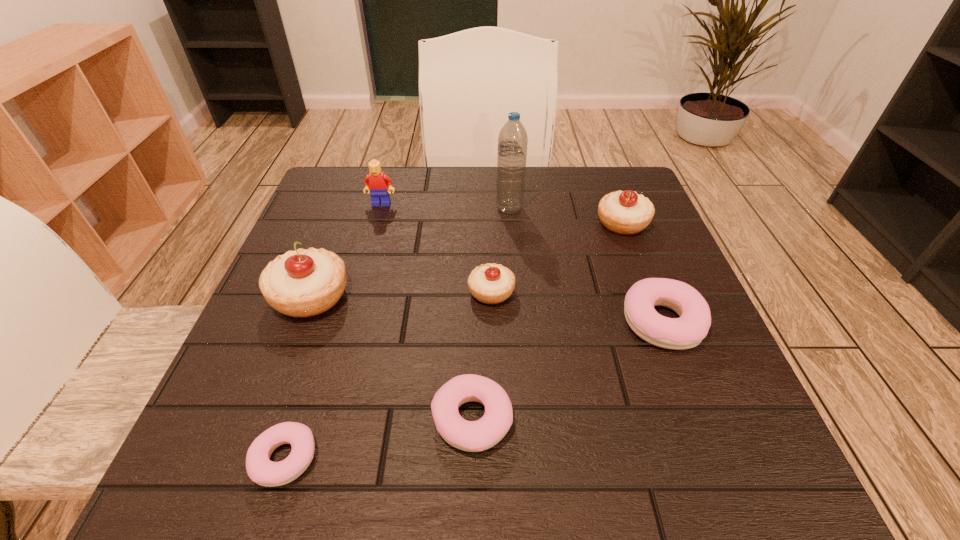
Find the location of `beige pastry that is the second closest to the tallest pastry`. beige pastry that is the second closest to the tallest pastry is located at coordinates (624, 212).

Find the location of a particular element. Image resolution: width=960 pixels, height=540 pixels. the second closest beige pastry to the tallest object is located at coordinates (491, 283).

Point out which pink pastry is positioned as the nearest to the second shortest object. Please provide its 2D coordinates. Your answer should be formatted as a tuple, i.e. [(x, y)], where the tuple contains the x and y coordinates of a point satisfying the conditions above.

[(260, 469)]

Where is `pink pastry that is the second nearest to the second shortest object`? pink pastry that is the second nearest to the second shortest object is located at coordinates (688, 331).

Locate an element on the screen. This screenshot has width=960, height=540. free spot that satisfies the following two spatial constraints: 1. on the back side of the tallest object; 2. on the right side of the second biggest pink pastry is located at coordinates (475, 208).

I want to click on vacant space that satisfies the following two spatial constraints: 1. on the face of the Lego; 2. on the right side of the biggest pink pastry, so click(x=348, y=322).

Find the location of a particular element. free space that satisfies the following two spatial constraints: 1. on the face of the second shortest object; 2. on the right side of the Lego is located at coordinates (322, 420).

Locate an element on the screen. vacant region that satisfies the following two spatial constraints: 1. on the front side of the tallest object; 2. on the left side of the biggest pink pastry is located at coordinates (518, 322).

You are a GUI agent. You are given a task and a screenshot of the screen. Output one action in this format:
    pyautogui.click(x=<x>, y=<y>)
    Task: Click on the free point that satisfies the following two spatial constraints: 1. on the back side of the blue water bottle; 2. on the left side of the second beige pastry from left to right
    
    Given the screenshot: What is the action you would take?
    pyautogui.click(x=490, y=208)